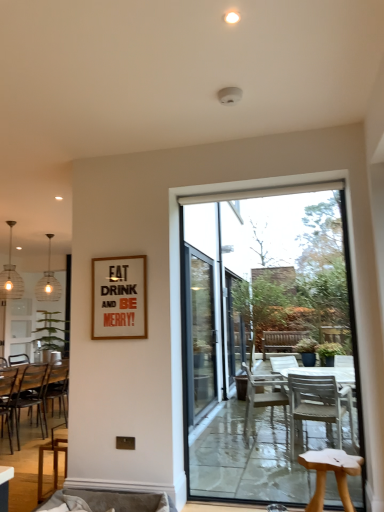
Question: From a real-world perspective, is green leafy plant at left over clear glass pendant light at left, which ranks as the second lamp in front-to-back order?

Choices:
 (A) no
 (B) yes

Answer: (A)

Question: Is green leafy plant at left bigger than clear glass pendant light at left, which appears as the first lamp when viewed from the back?

Choices:
 (A) yes
 (B) no

Answer: (A)

Question: Can you confirm if green leafy plant at left is positioned to the left of clear glass pendant light at left, which appears as the first lamp when viewed from the back?

Choices:
 (A) yes
 (B) no

Answer: (B)

Question: Is green leafy plant at left with clear glass pendant light at left, which ranks as the second lamp in front-to-back order?

Choices:
 (A) yes
 (B) no

Answer: (B)

Question: Can you confirm if green leafy plant at left is taller than clear glass pendant light at left, which appears as the first lamp when viewed from the back?

Choices:
 (A) no
 (B) yes

Answer: (A)

Question: From a real-world perspective, relative to velvet beige couch at lower center, is wooden frame at upper center vertically above or below?

Choices:
 (A) above
 (B) below

Answer: (A)

Question: Is wooden frame at upper center in front of or behind velvet beige couch at lower center in the image?

Choices:
 (A) behind
 (B) front

Answer: (A)

Question: Considering the positions of wooden frame at upper center and velvet beige couch at lower center in the image, is wooden frame at upper center wider or thinner than velvet beige couch at lower center?

Choices:
 (A) thin
 (B) wide

Answer: (A)

Question: Is point (109, 322) closer or farther from the camera than point (140, 506)?

Choices:
 (A) farther
 (B) closer

Answer: (A)

Question: Looking at the image, does transparent glass door at center seem bigger or smaller compared to green leafy plant at left?

Choices:
 (A) small
 (B) big

Answer: (A)

Question: Is transparent glass door at center in front of or behind green leafy plant at left in the image?

Choices:
 (A) behind
 (B) front

Answer: (B)

Question: Considering the relative positions of transparent glass door at center and green leafy plant at left in the image provided, is transparent glass door at center to the left or to the right of green leafy plant at left?

Choices:
 (A) right
 (B) left

Answer: (A)

Question: Is point (268, 327) closer or farther from the camera than point (56, 310)?

Choices:
 (A) closer
 (B) farther

Answer: (A)

Question: From a real-world perspective, relative to wooden chair at left, the 3th chair in the right-to-left sequence, is matte glass pendant light at left, positioned as the 2th lamp in back-to-front order, vertically above or below?

Choices:
 (A) above
 (B) below

Answer: (A)

Question: Is point (1, 295) positioned closer to the camera than point (13, 369)?

Choices:
 (A) farther
 (B) closer

Answer: (A)